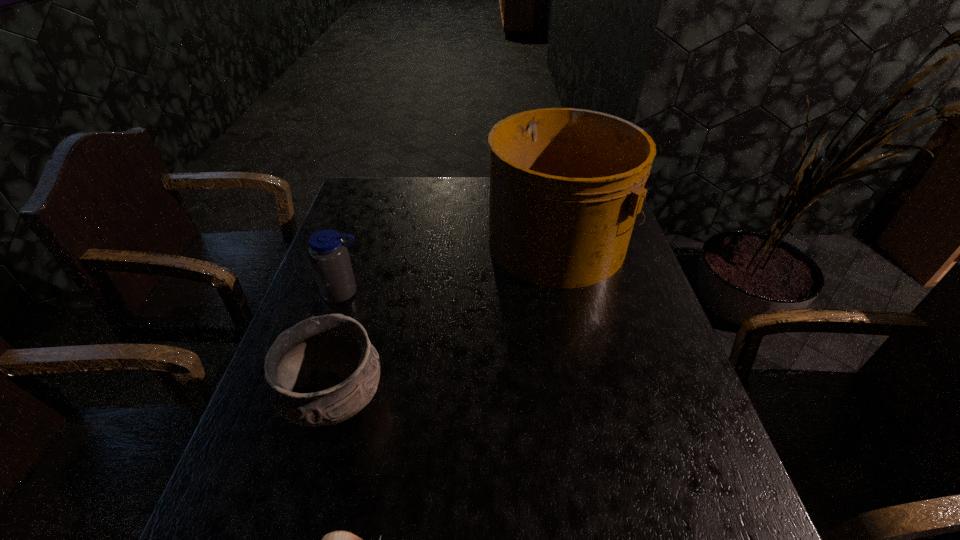
Locate an element on the screen. The width and height of the screenshot is (960, 540). object present at the right edge is located at coordinates (566, 184).

Where is `object at the far right corner`? The height and width of the screenshot is (540, 960). object at the far right corner is located at coordinates (566, 184).

Identify the location of free location at the near edge of the desktop. The height and width of the screenshot is (540, 960). (632, 522).

Find the location of `vacant space at the left edge of the desktop`. vacant space at the left edge of the desktop is located at coordinates (372, 274).

Find the location of `free region at the far left corner of the desktop`. free region at the far left corner of the desktop is located at coordinates (384, 190).

Locate an element on the screen. free spot at the near left corner of the desktop is located at coordinates click(x=258, y=528).

You are a GUI agent. You are given a task and a screenshot of the screen. Output one action in this format:
    pyautogui.click(x=<x>, y=<y>)
    Task: Click on the free space between the second nearest object and the tallest object
    
    Given the screenshot: What is the action you would take?
    pyautogui.click(x=446, y=321)

Where is `vacant space that's between the tallest object and the third farthest object`? The image size is (960, 540). vacant space that's between the tallest object and the third farthest object is located at coordinates pyautogui.click(x=446, y=321).

Where is `vacant area that lies between the water bottle and the tallest object`? The height and width of the screenshot is (540, 960). vacant area that lies between the water bottle and the tallest object is located at coordinates tap(451, 267).

Where is `blank region between the bucket and the water bottle`? The image size is (960, 540). blank region between the bucket and the water bottle is located at coordinates (451, 267).